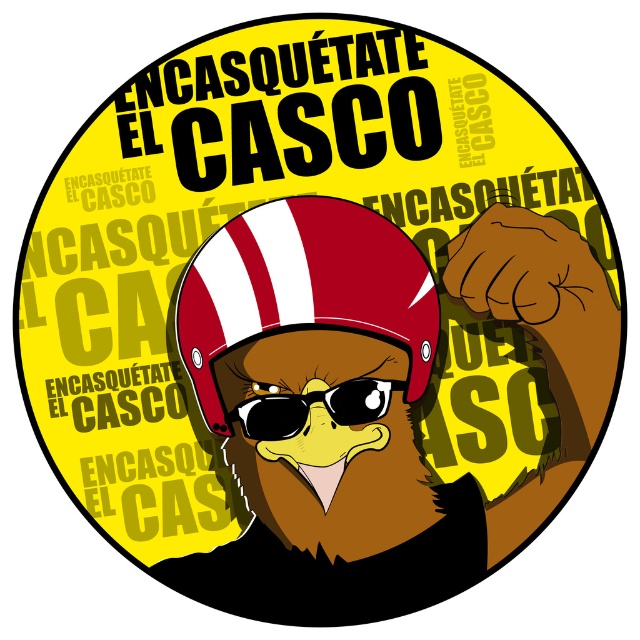
In the circular graphic design with a bold yellow background, there is a shiny red helmet at center and sunglassestransparent at center. Which object is taller?

The shiny red helmet at center is taller than the sunglassestransparent at center.

You are designing a sticker for a skateboard deck and have the shiny red helmet at center and the sunglassestransparent at center from the image. The skateboard deck is 7.5 centimeters wide. Can both items fit side by side horizontally without overlapping?

The shiny red helmet at center and sunglassestransparent at center are 2.22 centimeters apart. Since the skateboard deck is 7.5 centimeters wide, both items can fit side by side horizontally without overlapping as their combined width is less than the deck width.